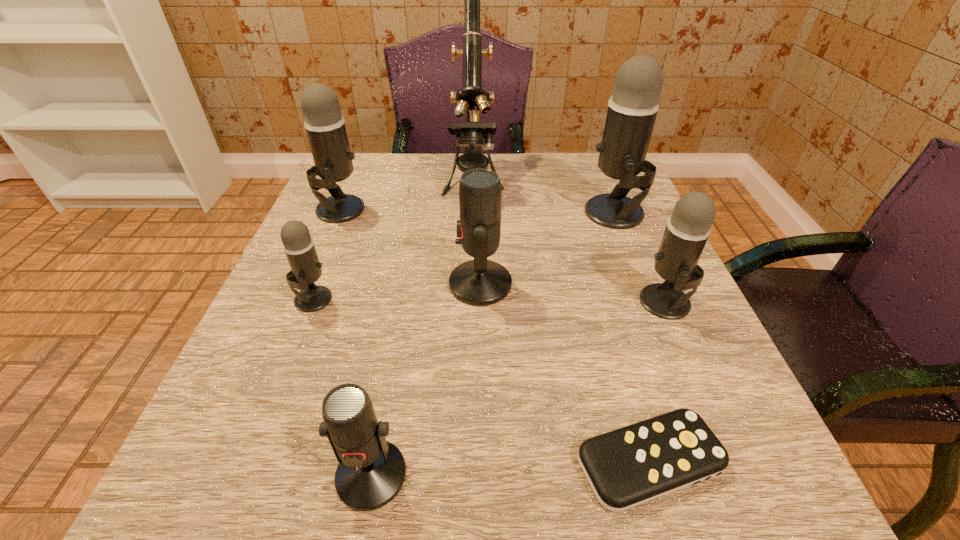
Find the location of a particular element. The width and height of the screenshot is (960, 540). free space at the right edge is located at coordinates (709, 410).

Locate an element on the screen. vacant space at the far left corner of the desktop is located at coordinates (376, 159).

The image size is (960, 540). I want to click on free space at the near right corner of the desktop, so click(x=790, y=488).

The width and height of the screenshot is (960, 540). I want to click on free space between the fourth microphone from left to right and the second tallest microphone, so click(x=410, y=247).

Locate an element on the screen. vacant point located between the second tallest object and the third biggest gray microphone is located at coordinates (640, 258).

In order to click on free space between the second biggest gray microphone and the smaller red microphone in this screenshot , I will do `click(356, 342)`.

The image size is (960, 540). I want to click on empty location between the shortest object and the third object from left to right, so click(511, 468).

The width and height of the screenshot is (960, 540). Identify the location of free space between the smaller red microphone and the sixth shortest object. (356, 342).

Image resolution: width=960 pixels, height=540 pixels. I want to click on vacant area that lies between the third biggest gray microphone and the shortest object, so click(x=658, y=382).

This screenshot has height=540, width=960. Find the location of `free space between the microscope and the second biggest gray microphone`. free space between the microscope and the second biggest gray microphone is located at coordinates (407, 194).